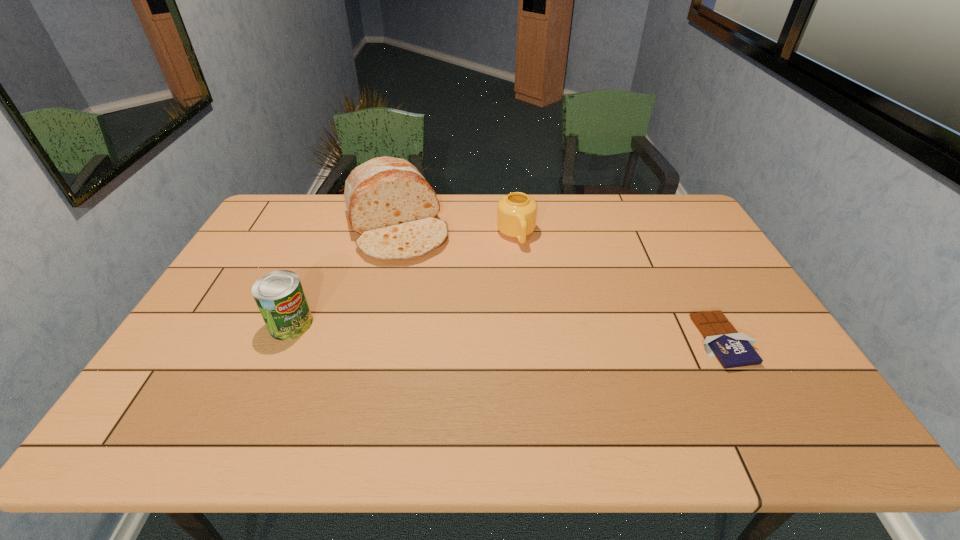
The height and width of the screenshot is (540, 960). Identify the location of can. (279, 295).

Locate an element on the screen. This screenshot has height=540, width=960. the shortest object is located at coordinates (733, 349).

Locate an element on the screen. This screenshot has height=540, width=960. the rightmost object is located at coordinates (733, 349).

At what (x,y) coordinates should I click in order to perform the action: click on mug. Please return your answer as a coordinate pair (x, y). Looking at the image, I should click on (516, 212).

Find the location of `the tallest object`. the tallest object is located at coordinates (389, 203).

Where is `free spot located 0.190m on the back of the can`? The width and height of the screenshot is (960, 540). free spot located 0.190m on the back of the can is located at coordinates (317, 266).

Locate an element on the screen. vacant position located 0.330m on the left of the chocolate bar is located at coordinates (571, 341).

At what (x,y) coordinates should I click in order to perform the action: click on vacant space located on the handle side of the third object from left to right. Please return your answer as a coordinate pair (x, y). This screenshot has width=960, height=540. Looking at the image, I should click on (529, 274).

Where is `vacant area located on the handle side of the third object from left to right`? Image resolution: width=960 pixels, height=540 pixels. vacant area located on the handle side of the third object from left to right is located at coordinates (550, 339).

At what (x,y) coordinates should I click in order to perform the action: click on vacant space situated on the handle side of the third object from left to right. Please return your answer as a coordinate pair (x, y). The image size is (960, 540). Looking at the image, I should click on (548, 333).